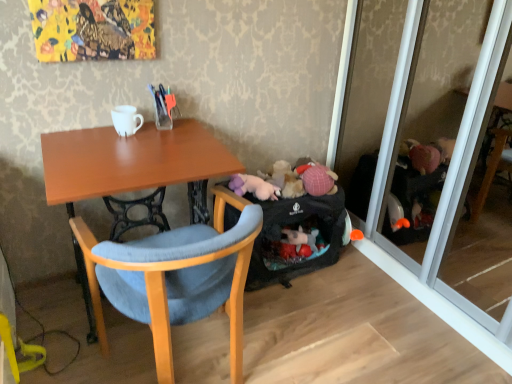
Identify the location of empty space that is to the right of white glossy coffee cup at upper center. (160, 140).